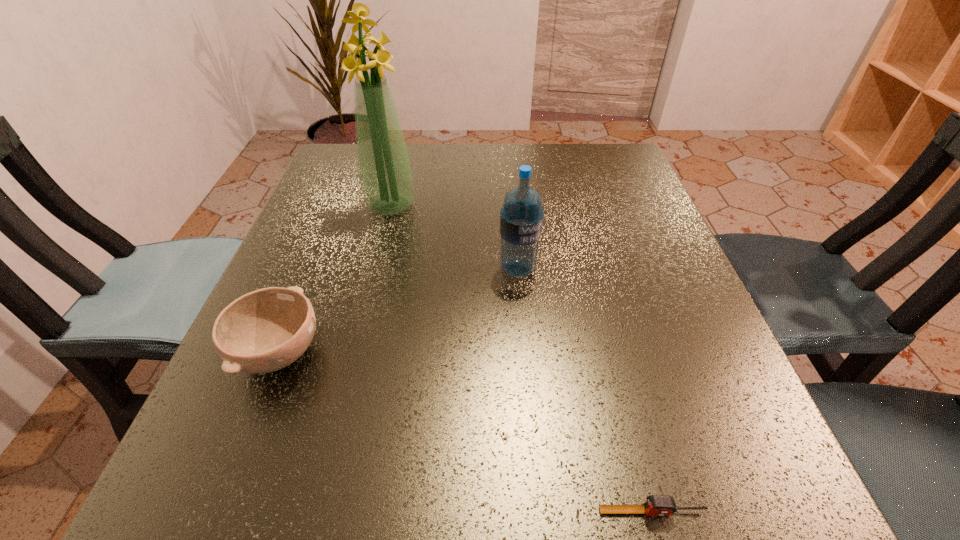
This screenshot has height=540, width=960. I want to click on the farthest object, so click(x=385, y=172).

This screenshot has width=960, height=540. Find the location of `bouquet`. bouquet is located at coordinates (385, 172).

The width and height of the screenshot is (960, 540). In order to click on the third object from left to right in this screenshot , I will do `click(521, 217)`.

You are a GUI agent. You are given a task and a screenshot of the screen. Output one action in this format:
    pyautogui.click(x=<x>, y=<y>)
    Task: Click on the water bottle
    This screenshot has height=540, width=960.
    Given the screenshot: What is the action you would take?
    pyautogui.click(x=521, y=217)

Find the location of a particular element. The height and width of the screenshot is (540, 960). the third tallest object is located at coordinates (263, 331).

Find the location of a particular element. Image resolution: width=960 pixels, height=540 pixels. the third farthest object is located at coordinates (263, 331).

Identify the location of the shortest object. This screenshot has height=540, width=960. (656, 505).

The width and height of the screenshot is (960, 540). Find the location of `the rightmost object`. the rightmost object is located at coordinates (656, 505).

Image resolution: width=960 pixels, height=540 pixels. What are the coordinates of `vacant space located 0.170m on the front-facing side of the tallest object` in the screenshot? It's located at (373, 276).

Find the location of a particular element. free point located 0.250m on the right of the water bottle is located at coordinates (673, 268).